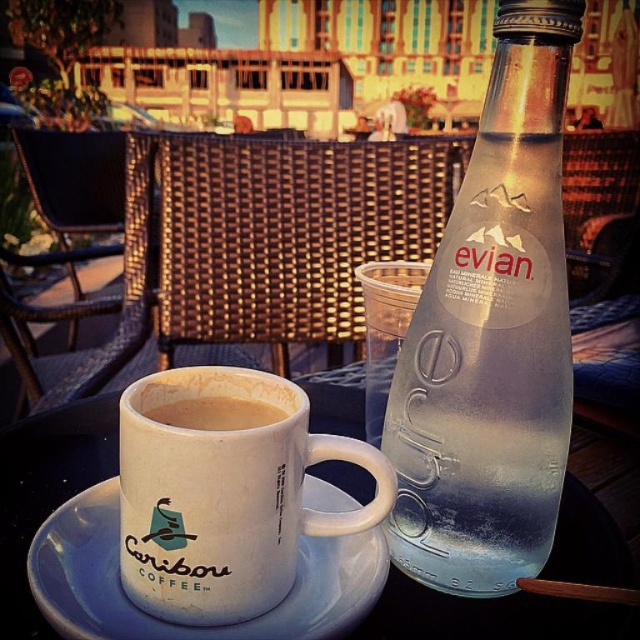
From the picture: You are a barista at the outdoor cafe and need to place a new drink order on the table. The drink is in a container that is 4 inches wide. Can you fit it between the clear glass bottle at upper right and the brown matte coffee cup at center without moving either item?

The clear glass bottle at upper right is 3.92 inches from the brown matte coffee cup at center. Since the container is 4 inches wide, it would not fit between them as the space is slightly narrower than the container.

You are a barista who just placed a brown matte coffee cup at center on a white ceramic saucer at center. Now, you need to slide the saucer forward to make space for another cup. Is the saucer currently positioned in front of or behind the coffee cup?

The white ceramic saucer at center is closer to the viewer than the brown matte coffee cup at center, so the saucer is positioned in front of the coffee cup. To make space, you can slide the saucer backward away from the viewer.

You are at an outdoor cafe and want to choose a taller cup for your coffee. Which one should you pick between the white matte mug at center and the brown matte coffee cup at center?

The white matte mug at center is taller than the brown matte coffee cup at center, so you should choose the white matte mug at center for a taller cup.